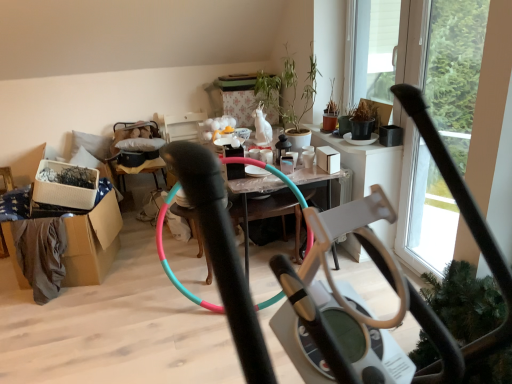
Question: Is wooden cushioned armchair at center-left at the back of translucent plastic table at center?

Choices:
 (A) no
 (B) yes

Answer: (B)

Question: From the image's perspective, is translucent plastic table at center located beneath wooden cushioned armchair at center-left?

Choices:
 (A) no
 (B) yes

Answer: (B)

Question: From a real-world perspective, is translucent plastic table at center under wooden cushioned armchair at center-left?

Choices:
 (A) no
 (B) yes

Answer: (A)

Question: Is the depth of translucent plastic table at center less than that of wooden cushioned armchair at center-left?

Choices:
 (A) yes
 (B) no

Answer: (A)

Question: Would you say translucent plastic table at center is a long distance from wooden cushioned armchair at center-left?

Choices:
 (A) yes
 (B) no

Answer: (A)

Question: Would you say matte black pot at upper right is to the left or to the right of green matte plant at upper center in the picture?

Choices:
 (A) left
 (B) right

Answer: (B)

Question: Is point [x=313, y=125] closer or farther from the camera than point [x=292, y=140]?

Choices:
 (A) farther
 (B) closer

Answer: (A)

Question: Is matte black pot at upper right wider or thinner than green matte plant at upper center?

Choices:
 (A) wide
 (B) thin

Answer: (B)

Question: In the image, is matte black pot at upper right positioned in front of or behind green matte plant at upper center?

Choices:
 (A) front
 (B) behind

Answer: (B)

Question: In the image, is white woven basket at left, the 1th box positioned from the left, on the left side or the right side of white matte box at center, which is the 1th box from right to left?

Choices:
 (A) right
 (B) left

Answer: (B)

Question: In terms of height, does white woven basket at left, the second box from the right, look taller or shorter compared to white matte box at center, which is the 1th box from right to left?

Choices:
 (A) tall
 (B) short

Answer: (A)

Question: Looking at their shapes, would you say white woven basket at left, the 1th box positioned from the left, is wider or thinner than white matte box at center, the 2th box positioned from the left?

Choices:
 (A) thin
 (B) wide

Answer: (B)

Question: From a real-world perspective, is white woven basket at left, the 1th box positioned from the left, positioned above or below white matte box at center, the 2th box positioned from the left?

Choices:
 (A) above
 (B) below

Answer: (B)

Question: From the image's perspective, is wooden cushioned armchair at center-left positioned above or below white woven basket at left, the second box from the right?

Choices:
 (A) above
 (B) below

Answer: (A)

Question: Is wooden cushioned armchair at center-left taller or shorter than white woven basket at left, the 1th box positioned from the left?

Choices:
 (A) tall
 (B) short

Answer: (A)